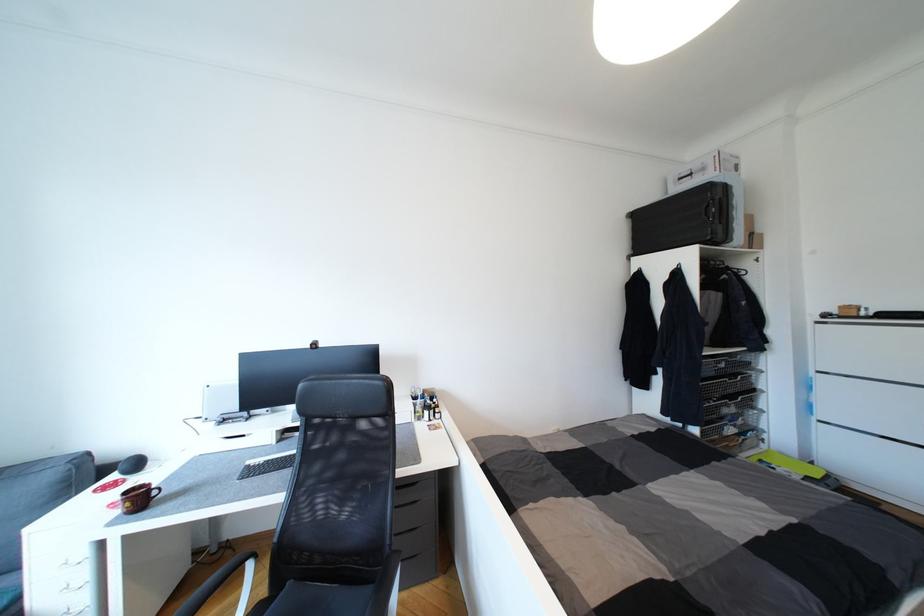
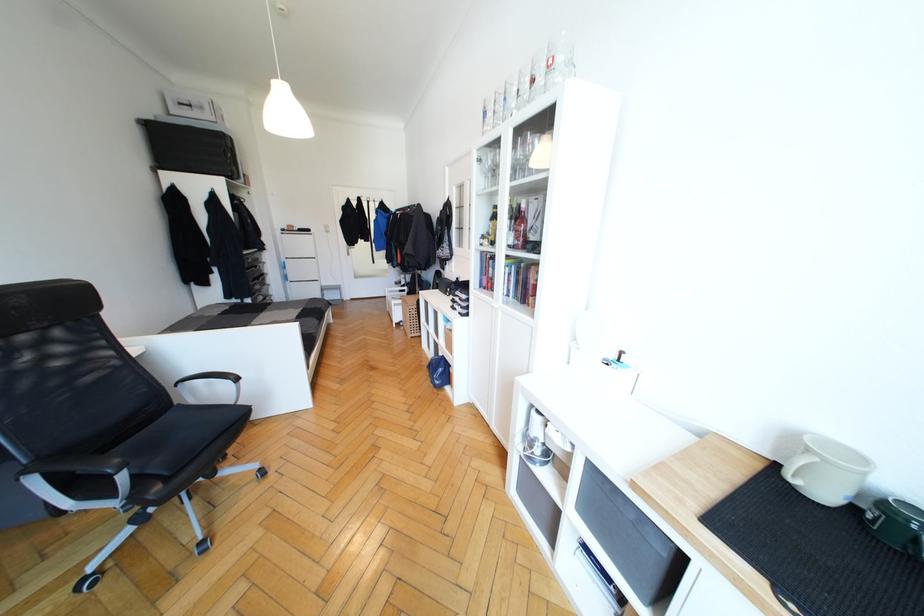
In the second image, find the point that corresponds to (x=694, y=176) in the first image.

(193, 108)